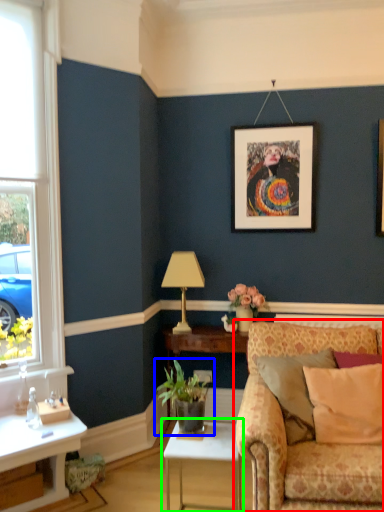
Question: Which object is positioned farthest from studio couch (highlighted by a red box)? Select from houseplant (highlighted by a blue box) and table (highlighted by a green box).

Choices:
 (A) houseplant
 (B) table

Answer: (A)